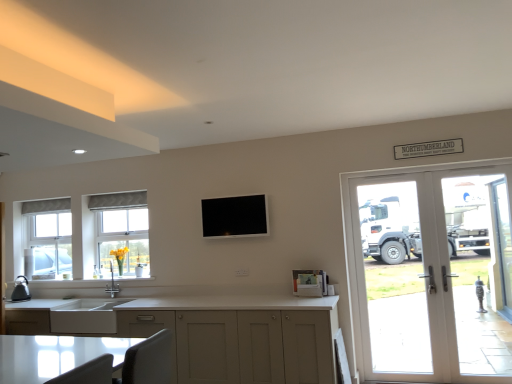
How much space does white textured window at center, acting as the first window starting from the right, occupy horizontally?

4.27 inches.

Image resolution: width=512 pixels, height=384 pixels. Describe the element at coordinates (240, 336) in the screenshot. I see `matte white cabinets at lower center` at that location.

At what (x,y) coordinates should I click in order to perform the action: click on clear glass door at right, acting as the second screen door starting from the left. Please return your answer as a coordinate pair (x, y). Image resolution: width=512 pixels, height=384 pixels. Looking at the image, I should click on (502, 241).

Measure the distance between white glass door at right and camera.

white glass door at right and camera are 3.81 meters apart.

Where is `matte black kettle at left`? matte black kettle at left is located at coordinates (21, 289).

This screenshot has width=512, height=384. What do you see at coordinates (21, 289) in the screenshot? I see `matte black kettle at left` at bounding box center [21, 289].

You are a GUI agent. You are given a task and a screenshot of the screen. Output one action in this format:
    pyautogui.click(x=<x>, y=<y>)
    Task: Click on the clear glass window at left, the first window in the left-to-right sequence
    
    Given the screenshot: What is the action you would take?
    pyautogui.click(x=48, y=239)

Does white matte sink at lower left appear on the right side of white glass screen door at right, the 1th screen door in the front-to-back sequence?

Incorrect, white matte sink at lower left is not on the right side of white glass screen door at right, the 1th screen door in the front-to-back sequence.

Based on the photo, is white glass screen door at right, the 1th screen door in the front-to-back sequence, a part of white matte sink at lower left?

No, white glass screen door at right, the 1th screen door in the front-to-back sequence, is located outside of white matte sink at lower left.

Between point (106, 304) and point (500, 323), which one is positioned behind?

The point (106, 304) is farther from the camera.

Does white matte sink at lower left come in front of white glass screen door at right, which is the second screen door in right-to-left order?

No.

Looking at this image, from a real-world perspective, between clear glass window at left, which is the second window in right-to-left order, and white textured window at center, which is the second window from left to right, who is vertically lower?

From a 3D spatial view, clear glass window at left, which is the second window in right-to-left order, is below.

Is clear glass window at left, the 2th window viewed from the front, shorter than white textured window at center, which is the second window from left to right?

Indeed, clear glass window at left, the 2th window viewed from the front, has a lesser height compared to white textured window at center, which is the second window from left to right.

Consider the image. Is white textured window at center, which is the second window from left to right, inside clear glass window at left, the 2th window viewed from the front?

No, white textured window at center, which is the second window from left to right, is located outside of clear glass window at left, the 2th window viewed from the front.

Is clear glass window at left, the 2th window viewed from the front, positioned with its back to white textured window at center, which is counted as the second window, starting from the back?

No, clear glass window at left, the 2th window viewed from the front,'s orientation is not away from white textured window at center, which is counted as the second window, starting from the back.

Is white glass door at right positioned with its back to clear glass door at right, which is the first screen door in right-to-left order?

Yes.

Considering the points (426, 314) and (506, 262), which point is behind, point (426, 314) or point (506, 262)?

The point (426, 314) is farther.

Is white glass door at right in front of or behind clear glass door at right, arranged as the first screen door when viewed from the back, in the image?

In the image, white glass door at right appears in front of clear glass door at right, arranged as the first screen door when viewed from the back.

Which is more to the left, white glass door at right or clear glass door at right, which is the first screen door in right-to-left order?

white glass door at right is more to the left.

Can you confirm if clear glass window at left, the first window in the left-to-right sequence, is smaller than white matte sink at lower left?

Correct, clear glass window at left, the first window in the left-to-right sequence, occupies less space than white matte sink at lower left.

Considering the relative sizes of clear glass window at left, the first window in the left-to-right sequence, and white matte sink at lower left in the image provided, is clear glass window at left, the first window in the left-to-right sequence, wider than white matte sink at lower left?

In fact, clear glass window at left, the first window in the left-to-right sequence, might be narrower than white matte sink at lower left.

Which is nearer, [56,245] or [66,330]?

Point [56,245] is farther from the camera than point [66,330].

From a real-world perspective, count 1st screen doors upward from the matte white cabinets at lower center and point to it. Please provide its 2D coordinates.

[(481, 271)]

Does point (503, 272) come farther from viewer compared to point (283, 326)?

Yes, it is behind point (283, 326).

From a real-world perspective, which object stands above the other?

From a 3D spatial view, white glass screen door at right, which ranks as the 2th screen door in back-to-front order, is above.

Is clear glass door at right, arranged as the first screen door when viewed from the back, next to white textured window at center, acting as the first window starting from the right?

clear glass door at right, arranged as the first screen door when viewed from the back, and white textured window at center, acting as the first window starting from the right, are not in contact.

You are a GUI agent. You are given a task and a screenshot of the screen. Output one action in this format:
    pyautogui.click(x=<x>, y=<y>)
    Task: Click on the screen door that is the 1st one below the white textured window at center, which is the second window from left to right (from a real-world perspective)
    The image size is (512, 384).
    Given the screenshot: What is the action you would take?
    pyautogui.click(x=502, y=241)

From a real-world perspective, which object rests below the other?

clear glass door at right, the second screen door from the front, from a real-world perspective.

Can you confirm if white glass screen door at right, the 1th screen door in the front-to-back sequence, is taller than matte black kettle at left?

Correct, white glass screen door at right, the 1th screen door in the front-to-back sequence, is much taller as matte black kettle at left.

Does white glass screen door at right, which ranks as the 2th screen door in back-to-front order, have a greater width compared to matte black kettle at left?

No, white glass screen door at right, which ranks as the 2th screen door in back-to-front order, is not wider than matte black kettle at left.

Image resolution: width=512 pixels, height=384 pixels. What are the coordinates of `appliance behind the white glass screen door at right, which is the second screen door in right-to-left order` in the screenshot? It's located at pyautogui.click(x=21, y=289).

What's the angular difference between white glass screen door at right, the first screen door from the left, and matte black kettle at left's facing directions?

The facing directions of white glass screen door at right, the first screen door from the left, and matte black kettle at left are 1.3 degrees apart.

Find the location of a particular element. The width and height of the screenshot is (512, 384). sink behind the white glass screen door at right, which is the second screen door in right-to-left order is located at coordinates (86, 316).

Where is `window that is under the white textured window at center, which is counted as the second window, starting from the back (from a real-world perspective)`? This screenshot has height=384, width=512. window that is under the white textured window at center, which is counted as the second window, starting from the back (from a real-world perspective) is located at coordinates (48, 239).

When comparing their distances from clear glass door at right, acting as the second screen door starting from the left, does white matte sink at lower left or matte black kettle at left seem closer?

white matte sink at lower left lies closer to clear glass door at right, acting as the second screen door starting from the left, than the other object.

Considering their positions, is white matte sink at lower left positioned closer to clear glass door at right, the second screen door from the front, than white glass screen door at right, the first screen door from the left?

The object closer to clear glass door at right, the second screen door from the front, is white glass screen door at right, the first screen door from the left.

Based on their spatial positions, is white textured window at center, which is the second window from left to right, or clear glass door at right, which is the first screen door in right-to-left order, closer to matte black kettle at left?

Among the two, white textured window at center, which is the second window from left to right, is located nearer to matte black kettle at left.

Which object lies nearer to the anchor point matte white cabinets at lower center, white glass door at right or white textured window at center, positioned as the first window in front-to-back order?

white textured window at center, positioned as the first window in front-to-back order, is closer to matte white cabinets at lower center.

Which object lies nearer to the anchor point white textured window at center, positioned as the first window in front-to-back order, white matte sink at lower left or white glass door at right?

The object closer to white textured window at center, positioned as the first window in front-to-back order, is white matte sink at lower left.

Considering their positions, is white textured window at center, which is the second window from left to right, positioned closer to clear glass door at right, which is the first screen door in right-to-left order, than matte black kettle at left?

white textured window at center, which is the second window from left to right, lies closer to clear glass door at right, which is the first screen door in right-to-left order, than the other object.

Estimate the real-world distances between objects in this image. Which object is closer to white matte sink at lower left, clear glass door at right, arranged as the first screen door when viewed from the back, or white glass screen door at right, which is the second screen door in right-to-left order?

white glass screen door at right, which is the second screen door in right-to-left order, is closer to white matte sink at lower left.

When comparing their distances from white glass door at right, does clear glass window at left, which ranks as the first window in back-to-front order, or matte black kettle at left seem further?

The object further to white glass door at right is matte black kettle at left.

Locate an element on the screen. The image size is (512, 384). cabinetry situated between matte black kettle at left and white glass door at right from left to right is located at coordinates (240, 336).

The height and width of the screenshot is (384, 512). I want to click on window situated between white matte sink at lower left and clear glass door at right, acting as the second screen door starting from the left, from left to right, so click(116, 233).

Where is `cabinetry between white textured window at center, acting as the first window starting from the right, and white glass door at right, in the horizontal direction`? cabinetry between white textured window at center, acting as the first window starting from the right, and white glass door at right, in the horizontal direction is located at coordinates (240, 336).

This screenshot has width=512, height=384. I want to click on door between matte white cabinets at lower center and clear glass door at right, acting as the second screen door starting from the left, so click(x=431, y=274).